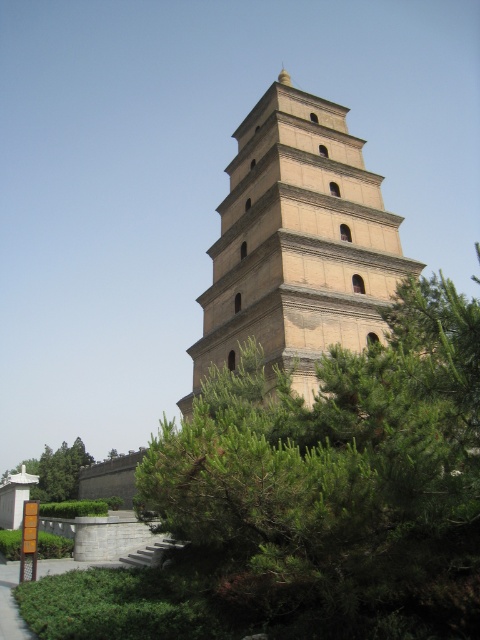
Does beige brick tower at center have a lesser width compared to green leafy tree at lower left?

Yes.

Which is behind, point (373, 292) or point (73, 481)?

Positioned behind is point (73, 481).

Locate an element on the screen. beige brick tower at center is located at coordinates (298, 243).

Does green leafy tree at center have a smaller size compared to beige brick tower at center?

Correct, green leafy tree at center occupies less space than beige brick tower at center.

Looking at this image, does green leafy tree at center appear on the left side of beige brick tower at center?

In fact, green leafy tree at center is to the right of beige brick tower at center.

You are a GUI agent. You are given a task and a screenshot of the screen. Output one action in this format:
    pyautogui.click(x=<x>, y=<y>)
    Task: Click on the green leafy tree at center
    The height and width of the screenshot is (640, 480).
    Given the screenshot: What is the action you would take?
    pyautogui.click(x=335, y=484)

Between green leafy tree at center and green leafy tree at lower left, which one appears on the right side from the viewer's perspective?

From the viewer's perspective, green leafy tree at center appears more on the right side.

Can you confirm if green leafy tree at center is bigger than green leafy tree at lower left?

Actually, green leafy tree at center might be smaller than green leafy tree at lower left.

Does point (319, 625) come farther from viewer compared to point (76, 461)?

No, it is not.

Find the location of a particular element. green leafy tree at center is located at coordinates (335, 484).